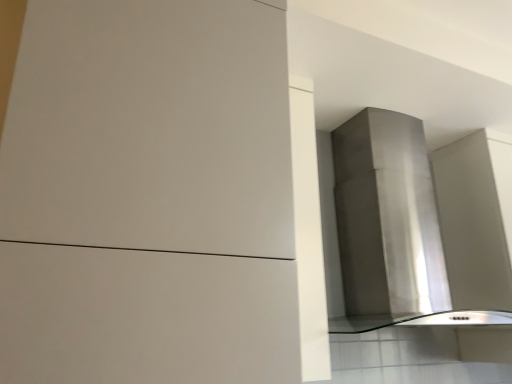
Question: From a real-world perspective, is matte white cabinet at center positioned above or below stainless steel vent at upper right?

Choices:
 (A) below
 (B) above

Answer: (A)

Question: Is matte white cabinet at center in front of or behind stainless steel vent at upper right in the image?

Choices:
 (A) front
 (B) behind

Answer: (A)

Question: Is point (187, 162) closer or farther from the camera than point (372, 200)?

Choices:
 (A) closer
 (B) farther

Answer: (A)

Question: Is stainless steel vent at upper right bigger or smaller than matte white cabinet at center?

Choices:
 (A) big
 (B) small

Answer: (B)

Question: Do you think stainless steel vent at upper right is within matte white cabinet at center, or outside of it?

Choices:
 (A) inside
 (B) outside

Answer: (B)

Question: From the image's perspective, is stainless steel vent at upper right located above or below matte white cabinet at center?

Choices:
 (A) above
 (B) below

Answer: (B)

Question: Relative to matte white cabinet at center, is stainless steel vent at upper right in front or behind?

Choices:
 (A) front
 (B) behind

Answer: (B)